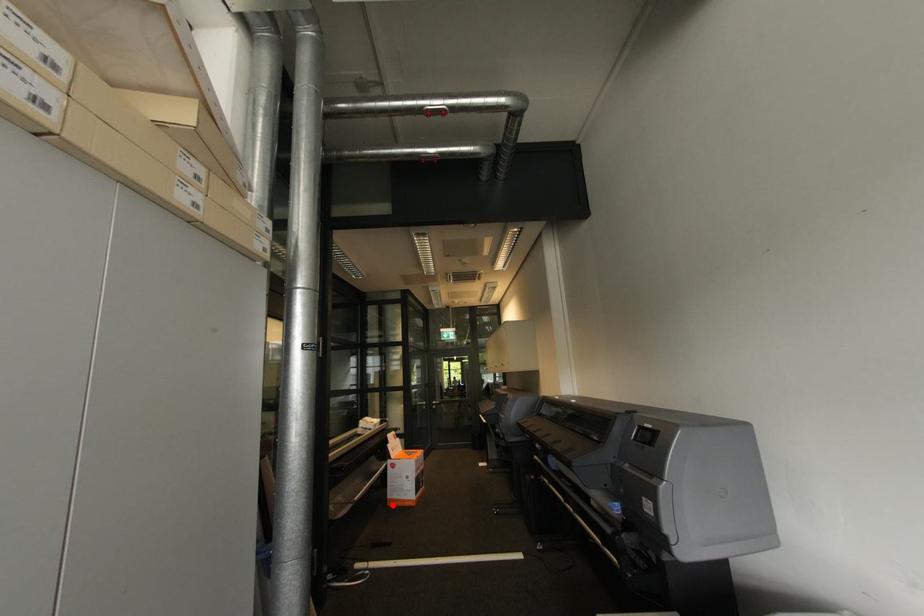
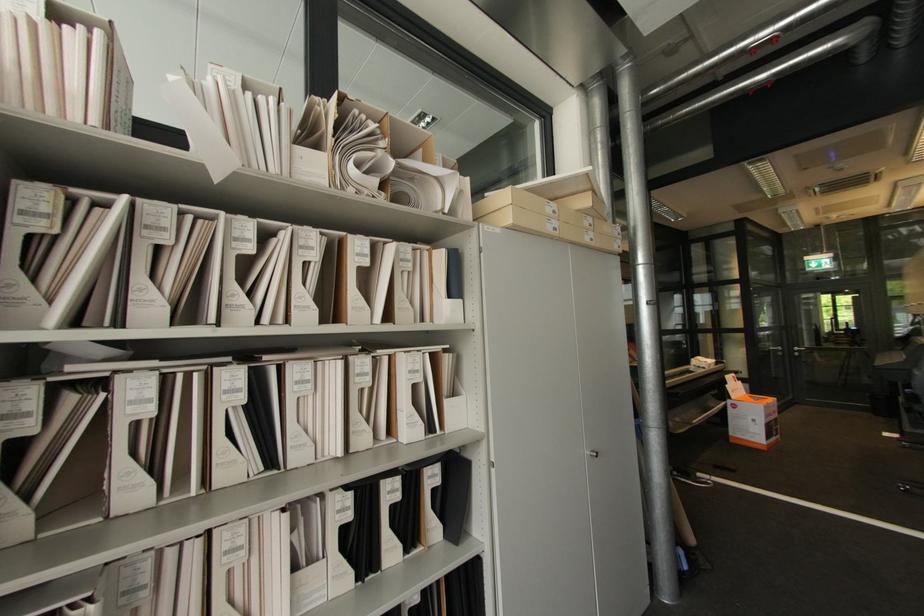
Question: I am providing you with two images of the same scene from different viewpoints. A red point is shown in image1. For the corresponding object point in image2, is it positioned nearer or farther from the camera?

Choices:
 (A) Nearer
 (B) Farther

Answer: (A)